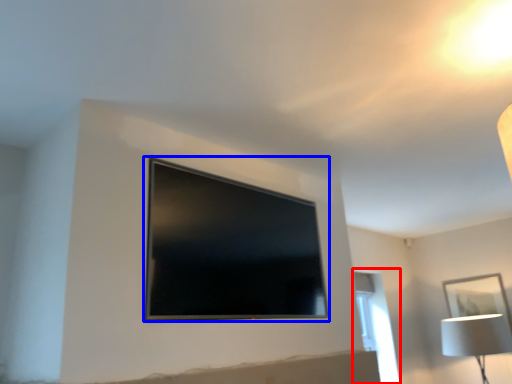
Question: Which of the following is the closest to the observer, window (highlighted by a red box) or television (highlighted by a blue box)?

Choices:
 (A) window
 (B) television

Answer: (B)